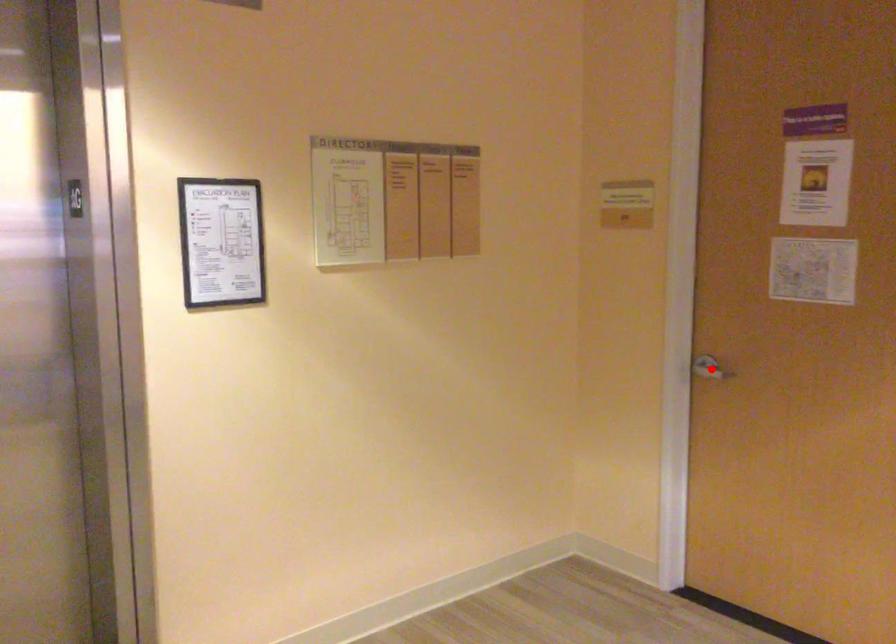
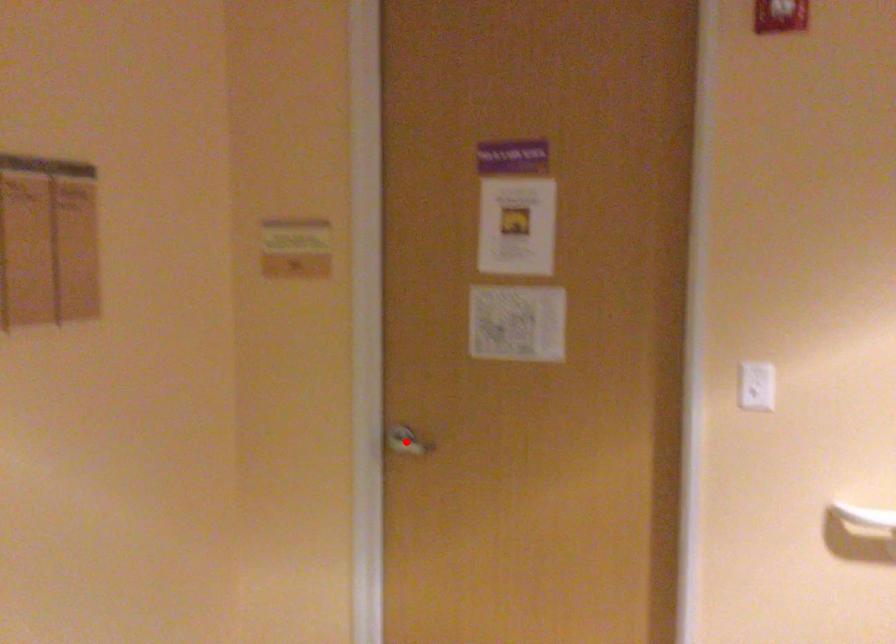
Looking at this image, I am providing you with two images of the same scene from different viewpoints. A red point is marked on the first image and another point is marked on the second image. Is the red point in image1 aligned with the point shown in image2?

Yes